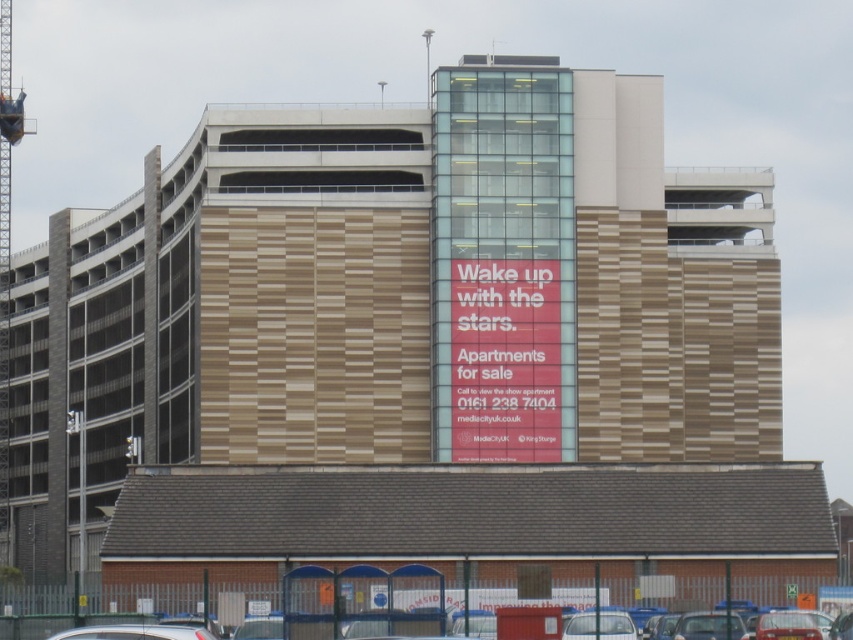
You are standing in front of the modern multi story building and want to see both the red matte sign at center and the silver metallic car at lower left. Which one is taller?

The red matte sign at center has a lesser height compared to silver metallic car at lower left, so the silver metallic car at lower left is taller.

You are standing at a point 100 meters away from the camera. You want to reach the point marked as point (x=485, y=259). Is this point closer to you than the camera?

The distance between point (x=485, y=259) and the camera is 101.57 meters. Since you are standing at a point 100 meters away from the camera, the point is farther away from you than the camera is.

You are a delivery driver who needs to park your car in the parking lot near the silver metallic car at lower left. The parking space next to the metallic gray crane at left is reserved for visitors. Can you park your car in that space?

The metallic gray crane at left is to the left of the silver metallic car at lower left, meaning the parking space next to the metallic gray crane at left is not adjacent to the silver metallic car at lower left. Therefore, you can park in the visitor parking space next to the metallic gray crane at left.